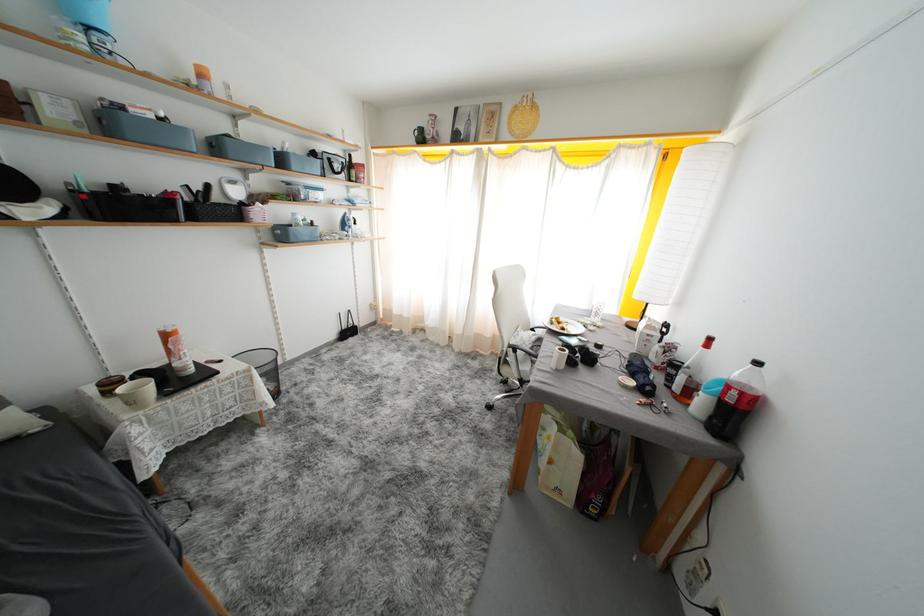
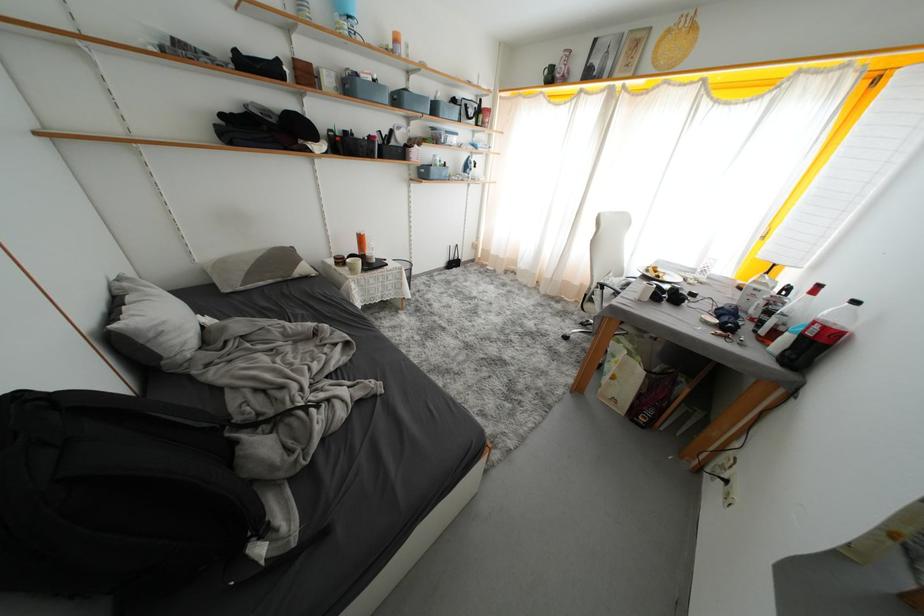
Find the pixel in the second image that matches pixel 735 391 in the first image.

(821, 328)